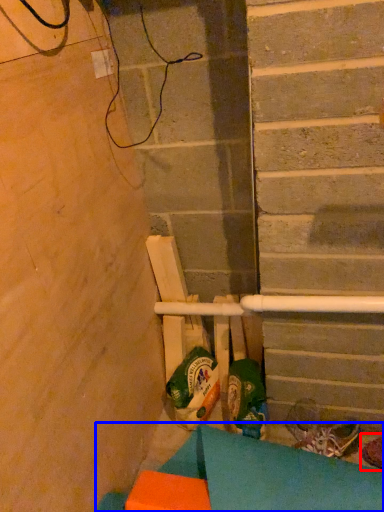
Question: Which object is further to the camera taking this photo, footwear (highlighted by a red box) or furniture (highlighted by a blue box)?

Choices:
 (A) footwear
 (B) furniture

Answer: (A)